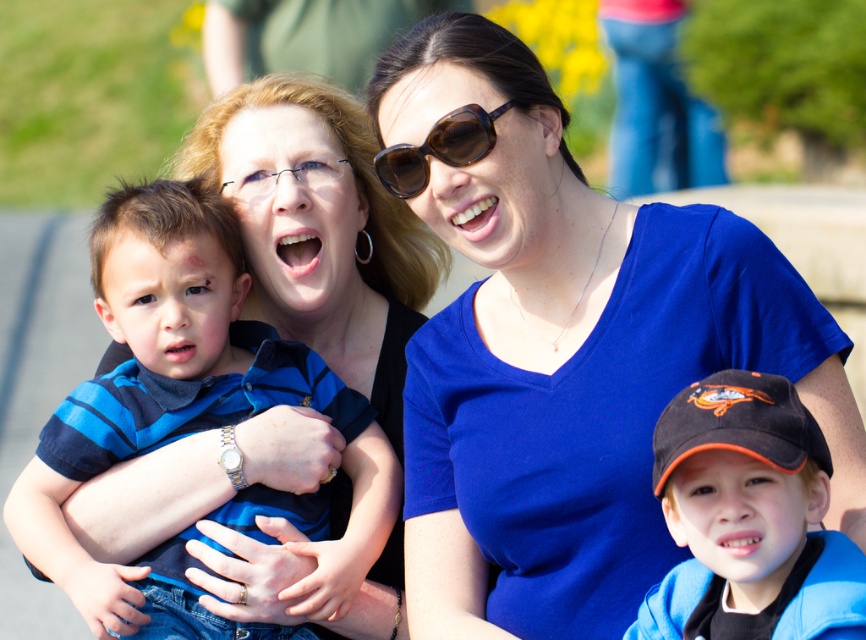
Is blue matte shirt at center positioned behind blue striped shirt at left?

No.

Who is higher up, blue matte shirt at center or blue striped shirt at left?

blue matte shirt at center is higher up.

Is point (464, 214) behind point (335, 596)?

No, (464, 214) is closer to viewer.

Locate an element on the screen. The height and width of the screenshot is (640, 866). blue matte shirt at center is located at coordinates (563, 348).

Is blue striped shirt at left behind black matte baseball cap at lower right?

Yes, it is.

Does blue striped shirt at left have a lesser width compared to black matte baseball cap at lower right?

No, blue striped shirt at left is not thinner than black matte baseball cap at lower right.

Is point (24, 529) positioned before point (703, 548)?

No, it is not.

Locate an element on the screen. The width and height of the screenshot is (866, 640). blue striped shirt at left is located at coordinates (191, 419).

Who is shorter, blue matte shirt at center or brown matte sunglasses at upper center?

Standing shorter between the two is brown matte sunglasses at upper center.

Does blue matte shirt at center have a greater width compared to brown matte sunglasses at upper center?

Yes, blue matte shirt at center is wider than brown matte sunglasses at upper center.

At what (x,y) coordinates should I click in order to perform the action: click on blue matte shirt at center. Please return your answer as a coordinate pair (x, y). Looking at the image, I should click on click(563, 348).

You are a GUI agent. You are given a task and a screenshot of the screen. Output one action in this format:
    pyautogui.click(x=<x>, y=<y>)
    Task: Click on the blue matte shirt at center
    The height and width of the screenshot is (640, 866).
    Given the screenshot: What is the action you would take?
    pyautogui.click(x=563, y=348)